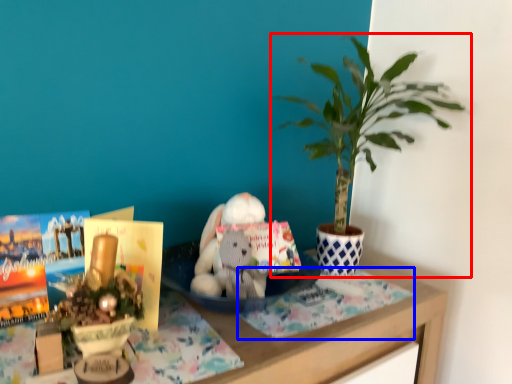
Question: Which point is closer to the camera, houseplant (highlighted by a red box) or cloth (highlighted by a blue box)?

Choices:
 (A) houseplant
 (B) cloth

Answer: (A)